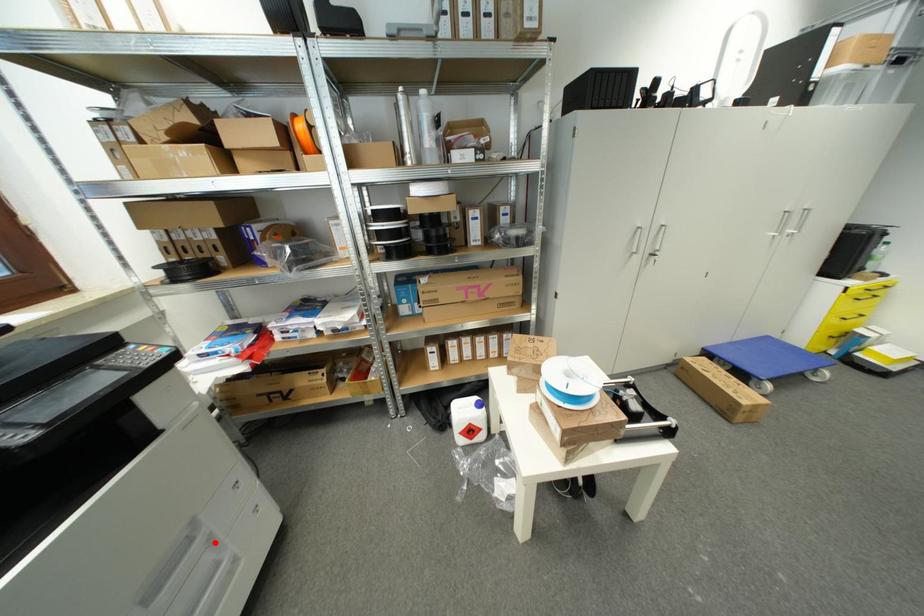
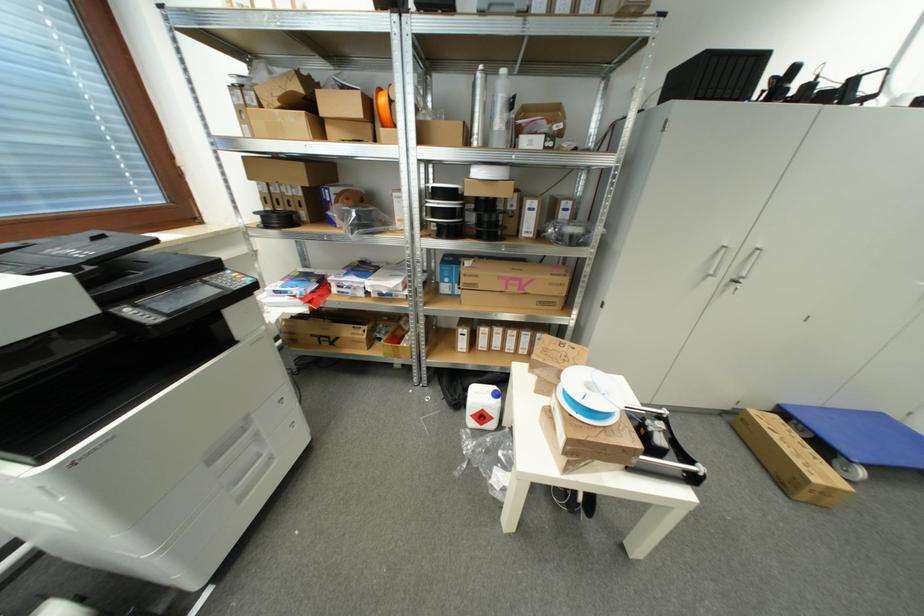
Locate, in the second image, the point that corresponds to the highlighted location in the first image.

(261, 438)